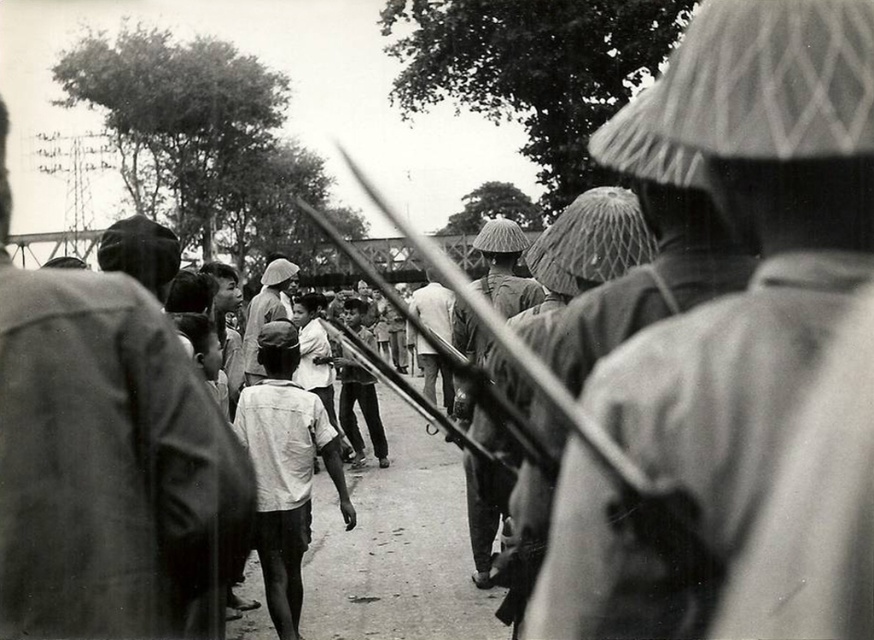
You are standing at the camera position in the scene. You see two points marked as point 1 at coordinates (133, 470) and point 2 at coordinates (304, 452). Which point is closer to you?

Point 1 at coordinates (133, 470) is closer to you because it is in front of point 2 at coordinates (304, 452).

You are a photographer who just took a black and white photo. In the image, you see a textured straw hat at center and a white cotton shirt at center. Which object in the photo appears bigger?

The textured straw hat at center appears larger than the white cotton shirt at center in the photo.

You are a photographer standing in the middle of the scene. You want to take a photo of the textured straw hat at center and the dark gray cloth jacket at left. Can you fit both of them in your camera frame if your camera has a 1.0 meter field of view?

The textured straw hat at center is 1.17 meters away from the dark gray cloth jacket at left. Since the distance between them is greater than the camera frame of 1.0 meters, you cannot fit both in the frame.